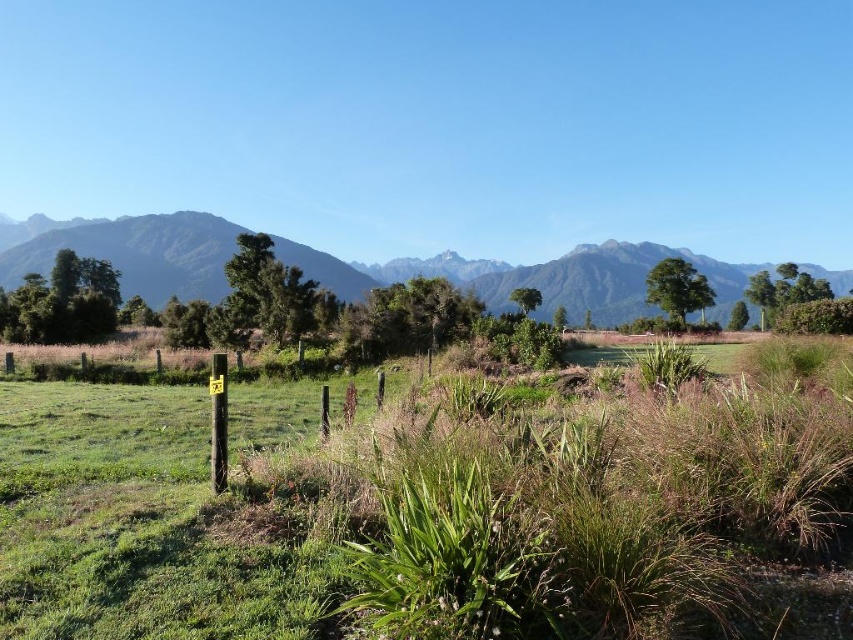
Which is above, green grassy at center or green grassy field at upper center?

Positioned higher is green grassy field at upper center.

Is point (38, 396) closer to viewer compared to point (335, 280)?

Yes.

Consider the image. Who is more forward, [622,472] or [636,257]?

Point [622,472] is in front.

What are the coordinates of `green grassy at center` in the screenshot? It's located at (437, 509).